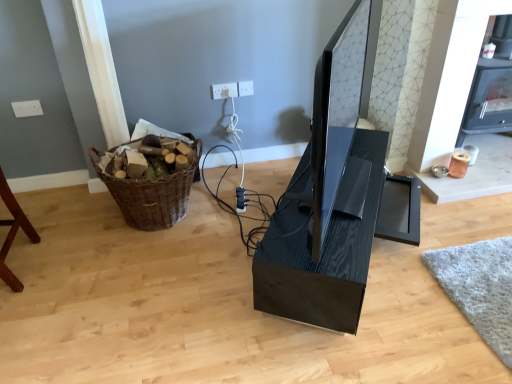
Question: Could you tell me if white plastic electric outlet at upper center, which appears as the 1th electric outlet when viewed from the right, is turned towards black plastic plug at center?

Choices:
 (A) yes
 (B) no

Answer: (B)

Question: Is white plastic electric outlet at upper center, which appears as the 1th electric outlet when viewed from the right, touching black plastic plug at center?

Choices:
 (A) yes
 (B) no

Answer: (B)

Question: Can you confirm if white plastic electric outlet at upper center, which ranks as the 2th electric outlet in left-to-right order, is wider than black plastic plug at center?

Choices:
 (A) yes
 (B) no

Answer: (B)

Question: Is white plastic electric outlet at upper center, which appears as the 1th electric outlet when viewed from the right, at the left side of black plastic plug at center?

Choices:
 (A) yes
 (B) no

Answer: (B)

Question: Is black plastic plug at center completely or partially inside white plastic electric outlet at upper center, which ranks as the 2th electric outlet in left-to-right order?

Choices:
 (A) yes
 (B) no

Answer: (B)

Question: Is white plastic electric outlet at upper center, the 1th electric outlet viewed from the left, bigger or smaller than white plastic electric outlet at upper center, which ranks as the 2th electric outlet in left-to-right order?

Choices:
 (A) small
 (B) big

Answer: (B)

Question: From their relative heights in the image, would you say white plastic electric outlet at upper center, the 1th electric outlet viewed from the left, is taller or shorter than white plastic electric outlet at upper center, which ranks as the 2th electric outlet in left-to-right order?

Choices:
 (A) short
 (B) tall

Answer: (B)

Question: In the image, is white plastic electric outlet at upper center, the 2th electric outlet when ordered from right to left, positioned in front of or behind white plastic electric outlet at upper center, which appears as the 1th electric outlet when viewed from the right?

Choices:
 (A) front
 (B) behind

Answer: (A)

Question: Considering the relative positions of white plastic electric outlet at upper center, the 1th electric outlet viewed from the left, and white plastic electric outlet at upper center, which ranks as the 2th electric outlet in left-to-right order, in the image provided, is white plastic electric outlet at upper center, the 1th electric outlet viewed from the left, to the left or to the right of white plastic electric outlet at upper center, which ranks as the 2th electric outlet in left-to-right order,?

Choices:
 (A) right
 (B) left

Answer: (B)

Question: Is white plastic electric outlet at upper center, the 1th electric outlet viewed from the left, to the left or to the right of woven brown basket at left in the image?

Choices:
 (A) left
 (B) right

Answer: (B)

Question: Considering the positions of white plastic electric outlet at upper center, the 1th electric outlet viewed from the left, and woven brown basket at left in the image, is white plastic electric outlet at upper center, the 1th electric outlet viewed from the left, wider or thinner than woven brown basket at left?

Choices:
 (A) wide
 (B) thin

Answer: (B)

Question: Would you say white plastic electric outlet at upper center, the 1th electric outlet viewed from the left, is inside or outside woven brown basket at left?

Choices:
 (A) outside
 (B) inside

Answer: (A)

Question: In terms of size, does white plastic electric outlet at upper center, the 1th electric outlet viewed from the left, appear bigger or smaller than woven brown basket at left?

Choices:
 (A) small
 (B) big

Answer: (A)

Question: Is woven brown basket at left inside the boundaries of matte black monitor at center, or outside?

Choices:
 (A) outside
 (B) inside

Answer: (A)

Question: Based on their positions, is woven brown basket at left located to the left or right of matte black monitor at center?

Choices:
 (A) right
 (B) left

Answer: (B)